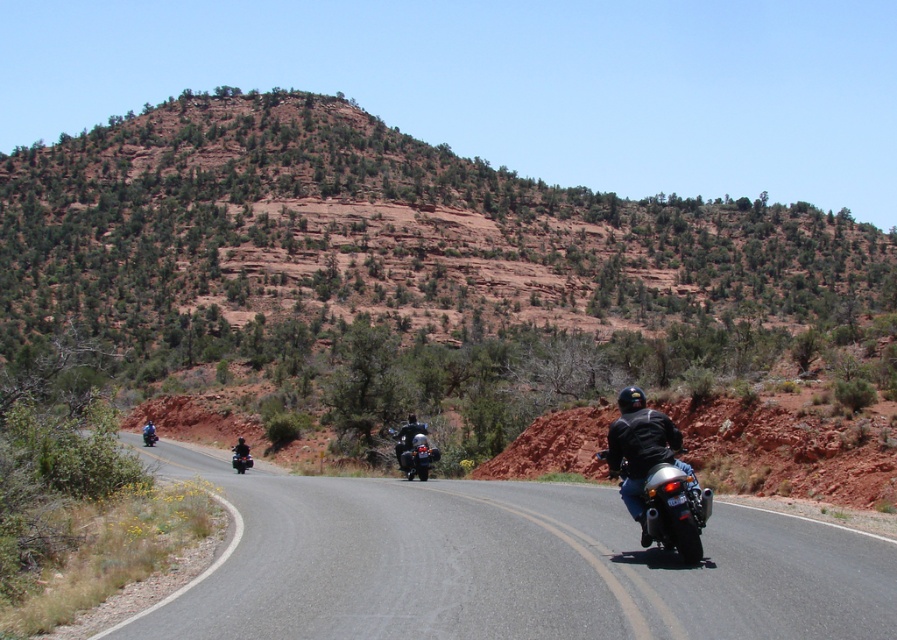
Question: Which point is closer to the camera?

Choices:
 (A) asphalt road at center
 (B) black leather jacket at right
 (C) dark gray leather jacket at center
 (D) shiny chrome motorcycle at center

Answer: (A)

Question: Estimate the real-world distances between objects in this image. Which object is closer to the asphalt road at center?

Choices:
 (A) shiny black motorcycle at center
 (B) blue leather jacket at center
 (C) shiny chrome motorcycle at center

Answer: (A)

Question: Can you confirm if asphalt road at center is positioned to the left of shiny black motorcycle at center?

Choices:
 (A) no
 (B) yes

Answer: (B)

Question: Estimate the real-world distances between objects in this image. Which object is farther from the dark gray leather jacket at center?

Choices:
 (A) black leather jacket at center
 (B) shiny chrome motorcycle at right
 (C) shiny chrome motorcycle at center
 (D) asphalt road at center

Answer: (B)

Question: Does shiny chrome motorcycle at right come in front of black leather jacket at center?

Choices:
 (A) yes
 (B) no

Answer: (A)

Question: Is asphalt road at center smaller than shiny chrome motorcycle at right?

Choices:
 (A) no
 (B) yes

Answer: (A)